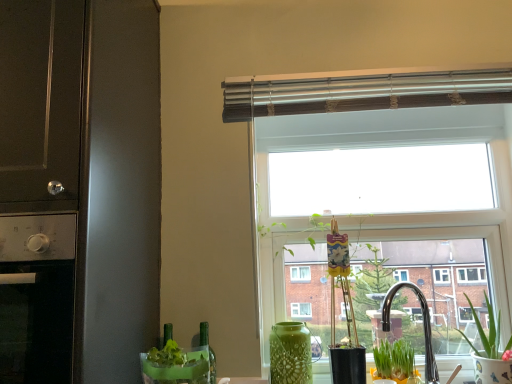
Question: From a real-world perspective, is transparent glass window at center located higher than green ceramic pot at lower right, the 1th houseplant viewed from the right?

Choices:
 (A) yes
 (B) no

Answer: (A)

Question: Considering the relative sizes of transparent glass window at center and green ceramic pot at lower right, the 1th houseplant viewed from the right, in the image provided, is transparent glass window at center wider than green ceramic pot at lower right, the 1th houseplant viewed from the right,?

Choices:
 (A) no
 (B) yes

Answer: (A)

Question: Can green ceramic pot at lower right, the 1th houseplant viewed from the right, be found inside transparent glass window at center?

Choices:
 (A) yes
 (B) no

Answer: (B)

Question: Is transparent glass window at center bigger than green ceramic pot at lower right, the 1th houseplant viewed from the right?

Choices:
 (A) yes
 (B) no

Answer: (A)

Question: From the image's perspective, does transparent glass window at center appear higher than green ceramic pot at lower right, the 1th houseplant viewed from the right?

Choices:
 (A) yes
 (B) no

Answer: (A)

Question: Is point click(x=274, y=99) closer or farther from the camera than point click(x=28, y=16)?

Choices:
 (A) closer
 (B) farther

Answer: (B)

Question: In terms of width, does transparent glass window at center look wider or thinner when compared to matte black oven at left, the second appliance positioned from the bottom?

Choices:
 (A) thin
 (B) wide

Answer: (A)

Question: Considering their positions, is transparent glass window at center located in front of or behind matte black oven at left, the second appliance positioned from the bottom?

Choices:
 (A) front
 (B) behind

Answer: (B)

Question: Choose the correct answer: Is transparent glass window at center inside matte black oven at left, placed as the first appliance when sorted from top to bottom, or outside it?

Choices:
 (A) inside
 (B) outside

Answer: (B)

Question: Is point (205, 379) closer or farther from the camera than point (99, 324)?

Choices:
 (A) closer
 (B) farther

Answer: (A)

Question: Is translucent green vase at lower center to the left or to the right of matte black oven at left, the second appliance positioned from the bottom, in the image?

Choices:
 (A) left
 (B) right

Answer: (B)

Question: From a real-world perspective, is translucent green vase at lower center positioned above or below matte black oven at left, the second appliance positioned from the bottom?

Choices:
 (A) below
 (B) above

Answer: (A)

Question: Considering the positions of translucent green vase at lower center and matte black oven at left, the second appliance positioned from the bottom, in the image, is translucent green vase at lower center wider or thinner than matte black oven at left, the second appliance positioned from the bottom,?

Choices:
 (A) thin
 (B) wide

Answer: (A)

Question: Is point (201, 322) positioned closer to the camera than point (153, 74)?

Choices:
 (A) closer
 (B) farther

Answer: (A)

Question: Is green glass bottle at lower center wider or thinner than matte black oven at left, the second appliance positioned from the bottom?

Choices:
 (A) thin
 (B) wide

Answer: (A)